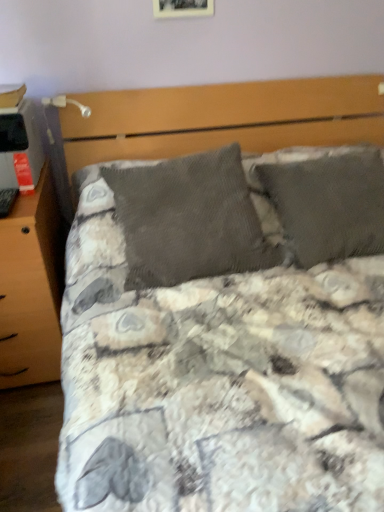
Question: Should I look upward or downward to see wooden photo frame at upper center?

Choices:
 (A) down
 (B) up

Answer: (B)

Question: Is wooden nightstand at left behind wooden photo frame at upper center?

Choices:
 (A) no
 (B) yes

Answer: (A)

Question: Is wooden photo frame at upper center located within wooden nightstand at left?

Choices:
 (A) yes
 (B) no

Answer: (B)

Question: Does wooden nightstand at left have a lesser width compared to wooden photo frame at upper center?

Choices:
 (A) yes
 (B) no

Answer: (B)

Question: Is wooden nightstand at left wider than wooden photo frame at upper center?

Choices:
 (A) no
 (B) yes

Answer: (B)

Question: Would you say wooden nightstand at left is a long distance from wooden photo frame at upper center?

Choices:
 (A) yes
 (B) no

Answer: (A)

Question: From the image's perspective, is wooden nightstand at left under wooden photo frame at upper center?

Choices:
 (A) no
 (B) yes

Answer: (B)

Question: Is metallic silver table lamp at upper left positioned with its back to wooden photo frame at upper center?

Choices:
 (A) yes
 (B) no

Answer: (B)

Question: Is metallic silver table lamp at upper left outside wooden photo frame at upper center?

Choices:
 (A) yes
 (B) no

Answer: (A)

Question: Is metallic silver table lamp at upper left shorter than wooden photo frame at upper center?

Choices:
 (A) no
 (B) yes

Answer: (B)

Question: Can you confirm if metallic silver table lamp at upper left is thinner than wooden photo frame at upper center?

Choices:
 (A) yes
 (B) no

Answer: (B)

Question: Is the depth of metallic silver table lamp at upper left greater than that of wooden photo frame at upper center?

Choices:
 (A) yes
 (B) no

Answer: (B)

Question: Considering the relative sizes of metallic silver table lamp at upper left and wooden photo frame at upper center in the image provided, is metallic silver table lamp at upper left wider than wooden photo frame at upper center?

Choices:
 (A) no
 (B) yes

Answer: (B)

Question: From a real-world perspective, is wooden photo frame at upper center beneath wooden nightstand at left?

Choices:
 (A) yes
 (B) no

Answer: (B)